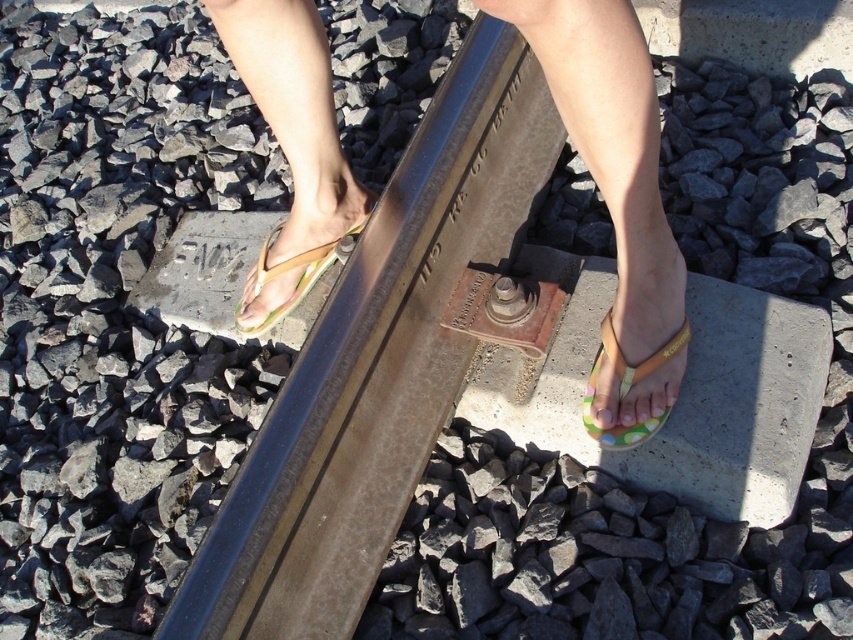
Which of these two, yellow rubber flip-flop at center or multicolored plastic flip-flop at center, stands shorter?

Standing shorter between the two is yellow rubber flip-flop at center.

In the scene shown: Is yellow rubber flip-flop at center thinner than multicolored plastic flip-flop at center?

Yes, yellow rubber flip-flop at center is thinner than multicolored plastic flip-flop at center.

Which is in front, point (613, 435) or point (260, 273)?

Point (613, 435)

The height and width of the screenshot is (640, 853). I want to click on yellow rubber flip-flop at center, so (627, 385).

Does smooth concrete block at center have a greater width compared to multicolored plastic flip-flop at center?

Yes.

Is smooth concrete block at center below multicolored plastic flip-flop at center?

Indeed, smooth concrete block at center is positioned under multicolored plastic flip-flop at center.

Between point (821, 380) and point (238, 314), which one is positioned in front?

Point (821, 380) is in front.

At what (x,y) coordinates should I click in order to perform the action: click on smooth concrete block at center. Please return your answer as a coordinate pair (x, y). This screenshot has width=853, height=640. Looking at the image, I should click on (677, 394).

Does polka dot flip-flops at center appear on the right side of multicolored plastic flip-flop at center?

Correct, you'll find polka dot flip-flops at center to the right of multicolored plastic flip-flop at center.

Consider the image. Which of these two, polka dot flip-flops at center or multicolored plastic flip-flop at center, stands shorter?

Standing shorter between the two is multicolored plastic flip-flop at center.

Between point (639, 29) and point (277, 316), which one is positioned in front?

Positioned in front is point (639, 29).

Locate an element on the screen. Image resolution: width=853 pixels, height=640 pixels. polka dot flip-flops at center is located at coordinates (616, 193).